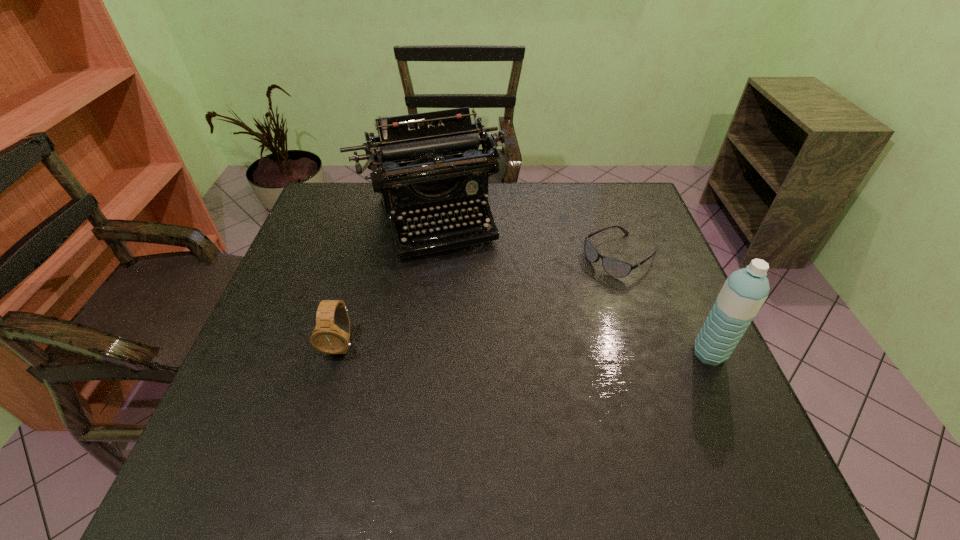
What are the coordinates of `vacant point at the right edge` in the screenshot? It's located at (647, 349).

Identify the location of free space at the far left corner of the desktop. The height and width of the screenshot is (540, 960). (352, 219).

In the image, there is a desktop. Where is `free space at the far right corner`? free space at the far right corner is located at coordinates [595, 196].

This screenshot has width=960, height=540. Identify the location of vacant area that lies between the water bottle and the sunglasses. (665, 305).

Find the location of a particular element. Image resolution: width=960 pixels, height=540 pixels. empty space between the third tallest object and the sunglasses is located at coordinates (481, 301).

I want to click on free space between the sunglasses and the typewriter, so click(x=523, y=238).

Locate an element on the screen. unoccupied area between the shortest object and the watch is located at coordinates click(x=481, y=301).

Identify the location of vacant point located between the watch and the typewriter. (384, 282).

You are a GUI agent. You are given a task and a screenshot of the screen. Output one action in this format:
    pyautogui.click(x=<x>, y=<y>)
    Task: Click on the empty space between the shortest object and the watch
    Image resolution: width=960 pixels, height=540 pixels.
    Given the screenshot: What is the action you would take?
    pyautogui.click(x=481, y=301)

This screenshot has height=540, width=960. In order to click on free spot between the water bottle and the typewriter in this screenshot , I will do (567, 286).